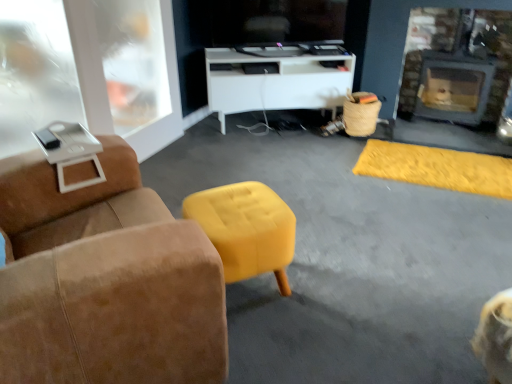
Identify the location of free area below brick fireplace at right (from a real-world perspective). The image size is (512, 384). (445, 125).